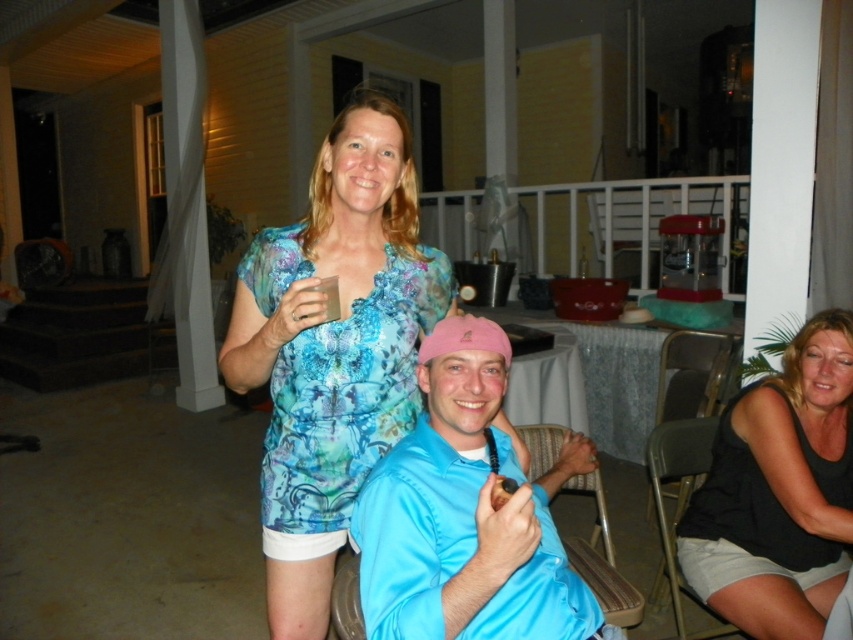
Where is `textured blue blouse at center`? The height and width of the screenshot is (640, 853). textured blue blouse at center is located at coordinates (334, 348).

Is textured blue blouse at center to the right of woven fabric chair at center from the viewer's perspective?

Incorrect, textured blue blouse at center is not on the right side of woven fabric chair at center.

What do you see at coordinates (334, 348) in the screenshot?
I see `textured blue blouse at center` at bounding box center [334, 348].

Find the location of a particular element. The image size is (853, 640). textured blue blouse at center is located at coordinates (334, 348).

Between textured blue blouse at center and black fabric chair at lower right, which one is positioned higher?

textured blue blouse at center is higher up.

Can you confirm if textured blue blouse at center is positioned below black fabric chair at lower right?

Incorrect, textured blue blouse at center is not positioned below black fabric chair at lower right.

The image size is (853, 640). In order to click on textured blue blouse at center in this screenshot , I will do (334, 348).

Locate an element on the screen. The height and width of the screenshot is (640, 853). textured blue blouse at center is located at coordinates (334, 348).

Does point (722, 600) come closer to viewer compared to point (708, 448)?

Yes.

Who is positioned more to the right, black cotton tank top at lower right or black fabric chair at lower right?

black cotton tank top at lower right

Between point (802, 372) and point (697, 632), which one is positioned behind?

The point (697, 632) is behind.

Locate an element on the screen. black cotton tank top at lower right is located at coordinates (779, 492).